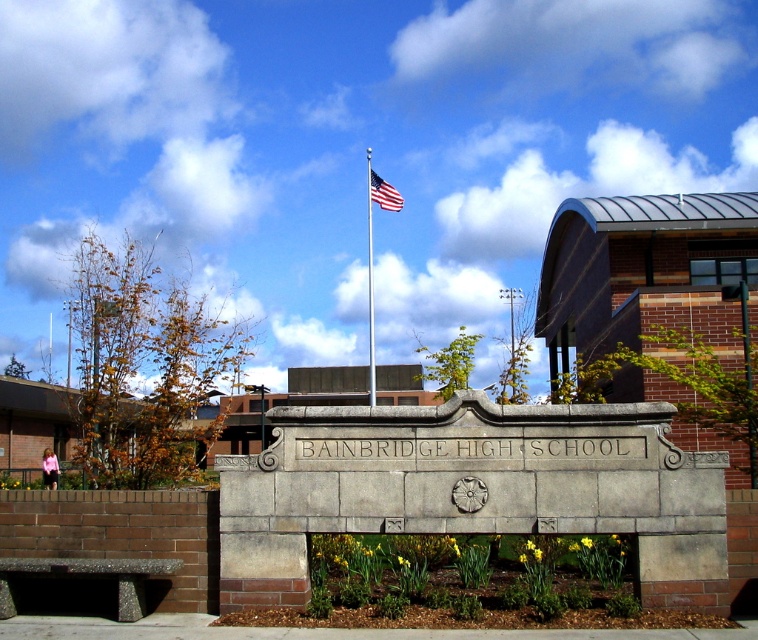
Question: Is polished metal flag pole at center thinner than american flag at center?

Choices:
 (A) yes
 (B) no

Answer: (A)

Question: Which of the following is the farthest from the observer?

Choices:
 (A) polished metal flag pole at center
 (B) american flag at center

Answer: (B)

Question: Can you confirm if polished metal flag pole at center is positioned above american flag at center?

Choices:
 (A) yes
 (B) no

Answer: (B)

Question: Is polished metal flag pole at center further to the viewer compared to american flag at center?

Choices:
 (A) no
 (B) yes

Answer: (A)